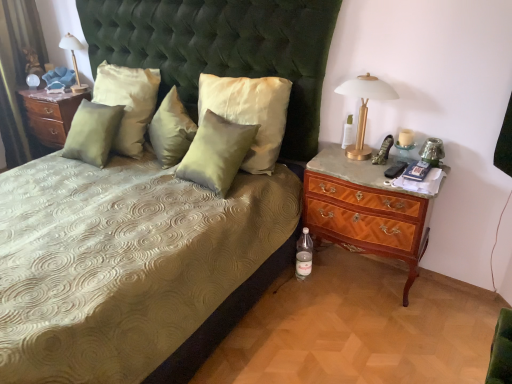
The image size is (512, 384). I want to click on mahogany wood nightstand at right, the first nightstand positioned from the right, so click(365, 210).

How much space does clear plastic bottle at lower right, arranged as the second bottle when viewed from the right, occupy horizontally?

8.87 centimeters.

Describe the element at coordinates (128, 102) in the screenshot. I see `satin green pillow at upper left, the fourth pillow positioned from the right` at that location.

In order to face satin green pillow at center, positioned as the 1th pillow in left-to-right order, should I rotate leftwards or rightwards?

You should look left and rotate roughly 20.559 degrees.

Where is `mahogany wood nightstand at right, which is the 2th nightstand from top to bottom`? The width and height of the screenshot is (512, 384). mahogany wood nightstand at right, which is the 2th nightstand from top to bottom is located at coordinates (365, 210).

From the picture: From the image's perspective, is matte wood nightstand at left, the 2th nightstand in the front-to-back sequence, on top of gold metallic table lamp at upper right, which appears as the 1th bedside lamp when viewed from the right?

Yes.

Does matte wood nightstand at left, positioned as the 2th nightstand in right-to-left order, turn towards gold metallic table lamp at upper right, positioned as the 2th bedside lamp in back-to-front order?

No.

Is matte wood nightstand at left, positioned as the 2th nightstand in right-to-left order, in front of or behind gold metallic table lamp at upper right, which ranks as the second bedside lamp in left-to-right order, in the image?

matte wood nightstand at left, positioned as the 2th nightstand in right-to-left order, is behind gold metallic table lamp at upper right, which ranks as the second bedside lamp in left-to-right order.

Is there a large distance between matte wood nightstand at left, the 2th nightstand in the front-to-back sequence, and gold metallic table lamp at upper right, the first bedside lamp from the front?

Yes, matte wood nightstand at left, the 2th nightstand in the front-to-back sequence, is far from gold metallic table lamp at upper right, the first bedside lamp from the front.

The width and height of the screenshot is (512, 384). In the image, there is a satin green bed at center. In order to click on bottle below it (from the image's perspective) in this screenshot , I will do `click(304, 255)`.

Is satin green bed at center a part of clear plastic bottle at lower right, the 1th bottle positioned from the left?

Definitely not — satin green bed at center is not inside clear plastic bottle at lower right, the 1th bottle positioned from the left.

Does clear plastic bottle at lower right, the 1th bottle positioned from the left, have a smaller size compared to satin green bed at center?

Indeed, clear plastic bottle at lower right, the 1th bottle positioned from the left, has a smaller size compared to satin green bed at center.

From a real-world perspective, who is located lower, clear plastic bottle at lower right, the 2th bottle positioned from the top, or satin green bed at center?

clear plastic bottle at lower right, the 2th bottle positioned from the top.

From a real-world perspective, is matte wood nightstand at left, positioned as the 2th nightstand in right-to-left order, under satin green pillow at upper left, the fourth pillow positioned from the right?

Yes, from a real-world perspective, matte wood nightstand at left, positioned as the 2th nightstand in right-to-left order, is under satin green pillow at upper left, the fourth pillow positioned from the right.

From the image's perspective, is matte wood nightstand at left, which is counted as the 1th nightstand, starting from the top, beneath satin green pillow at upper left, the fourth pillow positioned from the right?

Yes.

How much distance is there between matte wood nightstand at left, positioned as the 2th nightstand in right-to-left order, and satin green pillow at upper left, positioned as the second pillow in left-to-right order?

matte wood nightstand at left, positioned as the 2th nightstand in right-to-left order, and satin green pillow at upper left, positioned as the second pillow in left-to-right order, are 23.46 inches apart.

Does matte wood nightstand at left, the 1th nightstand from the left, have a lesser width compared to satin green pillow at upper left, positioned as the second pillow in left-to-right order?

No, matte wood nightstand at left, the 1th nightstand from the left, is not thinner than satin green pillow at upper left, positioned as the second pillow in left-to-right order.

Considering the relative positions of satin green pillow at center, positioned as the fourth pillow in left-to-right order, and translucent glass candle holder at right in the image provided, is satin green pillow at center, positioned as the fourth pillow in left-to-right order, to the right of translucent glass candle holder at right from the viewer's perspective?

Incorrect, satin green pillow at center, positioned as the fourth pillow in left-to-right order, is not on the right side of translucent glass candle holder at right.

From a real-world perspective, is satin green pillow at center, positioned as the fourth pillow in left-to-right order, above or below translucent glass candle holder at right?

satin green pillow at center, positioned as the fourth pillow in left-to-right order, is situated lower than translucent glass candle holder at right in the real world.

Who is more distant, satin green pillow at center, positioned as the fourth pillow in left-to-right order, or translucent glass candle holder at right?

satin green pillow at center, positioned as the fourth pillow in left-to-right order, is behind.

Image resolution: width=512 pixels, height=384 pixels. In order to click on candle holder located on the right of satin green pillow at center, positioned as the fourth pillow in left-to-right order in this screenshot , I will do `click(405, 144)`.

Is clear plastic bottle at lower right, the 1th bottle positioned from the left, turned away from satin green pillow at center, arranged as the second pillow when viewed from the right?

clear plastic bottle at lower right, the 1th bottle positioned from the left, is not turned away from satin green pillow at center, arranged as the second pillow when viewed from the right.

From the image's perspective, relative to satin green pillow at center, arranged as the second pillow when viewed from the right, is clear plastic bottle at lower right, the 1th bottle positioned from the left, above or below?

Clearly, from the image's perspective, clear plastic bottle at lower right, the 1th bottle positioned from the left, is below satin green pillow at center, arranged as the second pillow when viewed from the right.

Considering the sizes of objects clear plastic bottle at lower right, the 1th bottle positioned from the left, and satin green pillow at center, positioned as the fourth pillow in left-to-right order, in the image provided, who is shorter, clear plastic bottle at lower right, the 1th bottle positioned from the left, or satin green pillow at center, positioned as the fourth pillow in left-to-right order,?

clear plastic bottle at lower right, the 1th bottle positioned from the left, is shorter.

How far apart are clear plastic bottle at lower right, the 1th bottle positioned from the left, and satin green pillow at center, positioned as the fourth pillow in left-to-right order?

A distance of 61.67 centimeters exists between clear plastic bottle at lower right, the 1th bottle positioned from the left, and satin green pillow at center, positioned as the fourth pillow in left-to-right order.

Does satin green pillow at center, positioned as the fourth pillow in left-to-right order, appear on the left side of silky cream pillow at center, which is counted as the 1th pillow, starting from the right?

Yes, satin green pillow at center, positioned as the fourth pillow in left-to-right order, is to the left of silky cream pillow at center, which is counted as the 1th pillow, starting from the right.

Considering the sizes of satin green pillow at center, arranged as the second pillow when viewed from the right, and silky cream pillow at center, the 5th pillow from the left, in the image, is satin green pillow at center, arranged as the second pillow when viewed from the right, bigger or smaller than silky cream pillow at center, the 5th pillow from the left,?

Clearly, satin green pillow at center, arranged as the second pillow when viewed from the right, is smaller in size than silky cream pillow at center, the 5th pillow from the left.

Is satin green pillow at center, positioned as the fourth pillow in left-to-right order, turned away from silky cream pillow at center, which is counted as the 1th pillow, starting from the right?

Yes, satin green pillow at center, positioned as the fourth pillow in left-to-right order,'s orientation is away from silky cream pillow at center, which is counted as the 1th pillow, starting from the right.

From the picture: Can silky cream pillow at center, which is counted as the 1th pillow, starting from the right, be found inside satin green pillow at center, positioned as the fourth pillow in left-to-right order?

That's incorrect, silky cream pillow at center, which is counted as the 1th pillow, starting from the right, is not inside satin green pillow at center, positioned as the fourth pillow in left-to-right order.

Is satin green pillow at center, which appears as the fifth pillow when viewed from the right, wider than mahogany wood nightstand at right, the second nightstand viewed from the back?

In fact, satin green pillow at center, which appears as the fifth pillow when viewed from the right, might be narrower than mahogany wood nightstand at right, the second nightstand viewed from the back.

Considering the sizes of objects satin green pillow at center, which appears as the fifth pillow when viewed from the right, and mahogany wood nightstand at right, the second nightstand from the left, in the image provided, who is taller, satin green pillow at center, which appears as the fifth pillow when viewed from the right, or mahogany wood nightstand at right, the second nightstand from the left,?

mahogany wood nightstand at right, the second nightstand from the left.

Between satin green pillow at center, positioned as the 1th pillow in left-to-right order, and mahogany wood nightstand at right, the first nightstand when ordered from bottom to top, which one has larger size?

Bigger between the two is mahogany wood nightstand at right, the first nightstand when ordered from bottom to top.

Does point (80, 134) come in front of point (382, 231)?

That is False.

From a real-world perspective, count 1st bedside lamps upward from the matte wood nightstand at left, the 2th nightstand in the front-to-back sequence, and point to it. Please provide its 2D coordinates.

[(364, 108)]

This screenshot has width=512, height=384. I want to click on bed in front of the clear plastic bottle at lower right, arranged as the second bottle when viewed from the right, so click(224, 49).

When comparing their distances from translucent glass candle holder at right, does satin green pillow at center, positioned as the 3th pillow in left-to-right order, or satin green pillow at center, positioned as the 1th pillow in left-to-right order, seem closer?

satin green pillow at center, positioned as the 3th pillow in left-to-right order, is closer to translucent glass candle holder at right.

Which object lies further to the anchor point mahogany wood nightstand at right, which is the 2th nightstand from top to bottom, clear glass bottle at right, marked as the 1th bottle in a top-to-bottom arrangement, or satin green pillow at center, positioned as the fourth pillow in left-to-right order?

satin green pillow at center, positioned as the fourth pillow in left-to-right order, lies further to mahogany wood nightstand at right, which is the 2th nightstand from top to bottom, than the other object.

Estimate the real-world distances between objects in this image. Which object is closer to matte wood nightstand at left, positioned as the 2th nightstand in right-to-left order, mahogany wood nightstand at right, which is the 2th nightstand from top to bottom, or green velvet curtain at left?

green velvet curtain at left is positioned closer to the anchor matte wood nightstand at left, positioned as the 2th nightstand in right-to-left order.

Considering their positions, is satin green pillow at center, positioned as the 1th pillow in left-to-right order, positioned closer to matte wood nightstand at left, the 1th nightstand from the left, than clear plastic bottle at lower right, the 1th bottle from the bottom?

Based on the image, satin green pillow at center, positioned as the 1th pillow in left-to-right order, appears to be nearer to matte wood nightstand at left, the 1th nightstand from the left.

Which object lies further to the anchor point satin green bed at center, silky cream pillow at center, the 5th pillow from the left, or matte gold lamp at upper left, the second bedside lamp when ordered from right to left?

matte gold lamp at upper left, the second bedside lamp when ordered from right to left, is further to satin green bed at center.

From the image, which object appears to be farther from satin green pillow at upper left, the fourth pillow positioned from the right, satin green bed at center or clear plastic bottle at lower right, the 2th bottle positioned from the top?

Among the two, clear plastic bottle at lower right, the 2th bottle positioned from the top, is located further to satin green pillow at upper left, the fourth pillow positioned from the right.

Considering their positions, is satin green pillow at center, arranged as the second pillow when viewed from the right, positioned closer to gold metallic table lamp at upper right, positioned as the 2th bedside lamp in back-to-front order, than silky cream pillow at center, which is counted as the 1th pillow, starting from the right?

silky cream pillow at center, which is counted as the 1th pillow, starting from the right.

Considering their positions, is silky cream pillow at center, the 5th pillow from the left, positioned closer to clear glass bottle at right, which is counted as the second bottle, starting from the left, than translucent glass candle holder at right?

translucent glass candle holder at right is closer to clear glass bottle at right, which is counted as the second bottle, starting from the left.

Identify the location of bedside lamp between silky cream pillow at center, which is counted as the 1th pillow, starting from the right, and translucent glass candle holder at right. The width and height of the screenshot is (512, 384). (364, 108).

In order to click on pillow situated between satin green pillow at center, positioned as the fourth pillow in left-to-right order, and gold metallic table lamp at upper right, positioned as the 2th bedside lamp in back-to-front order, from left to right in this screenshot , I will do `click(250, 112)`.

The height and width of the screenshot is (384, 512). Find the location of `curtain between satin green bed at center and matte gold lamp at upper left, the first bedside lamp viewed from the left, in the front-back direction`. curtain between satin green bed at center and matte gold lamp at upper left, the first bedside lamp viewed from the left, in the front-back direction is located at coordinates (18, 78).

This screenshot has height=384, width=512. I want to click on bedside lamp between green velvet curtain at left and satin green pillow at center, the 3th pillow positioned from the right, from left to right, so click(74, 60).